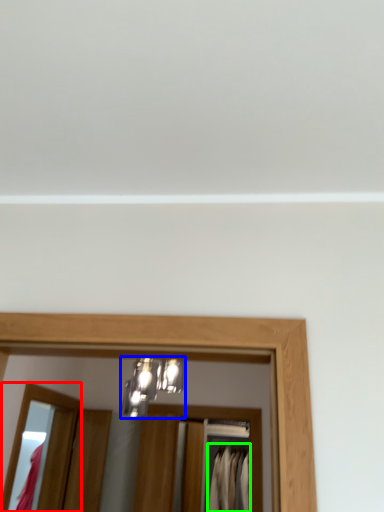
Question: Which is nearer to the mirror (highlighted by a red box)? light fixture (highlighted by a blue box) or clothing (highlighted by a green box).

Choices:
 (A) light fixture
 (B) clothing

Answer: (A)